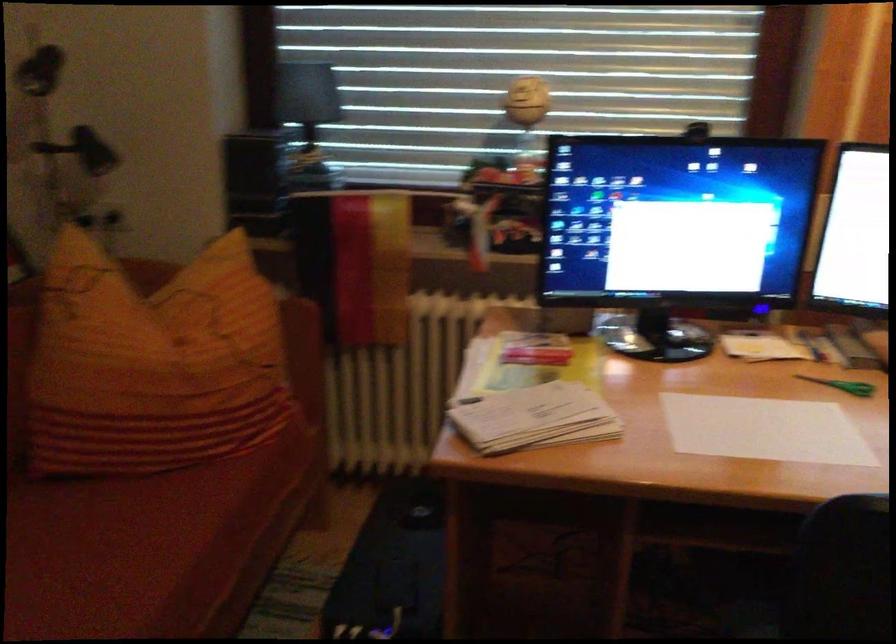
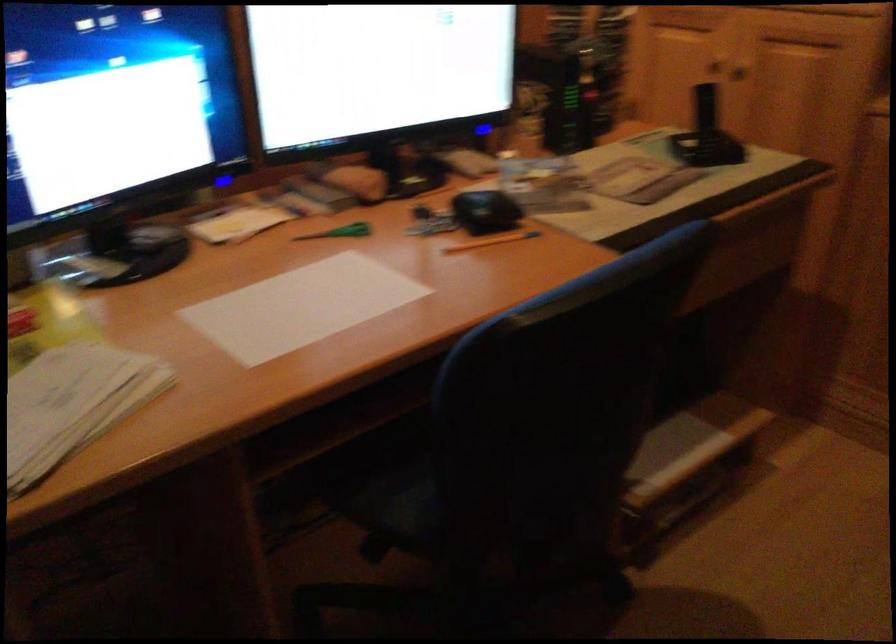
Question: The images are taken continuously from a first-person perspective. In which direction is your viewpoint rotating?

Choices:
 (A) Left
 (B) Right
 (C) Up
 (D) Down

Answer: (B)